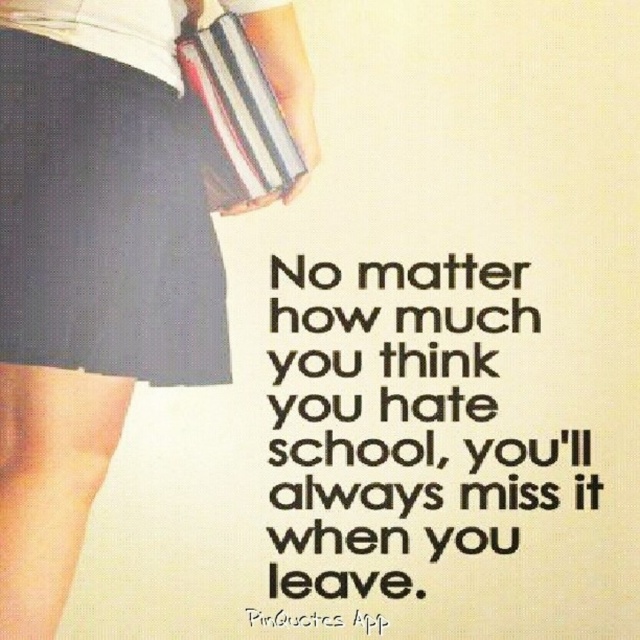
Based on the scene description, what is the color of the fabric at the coordinates point (x=102, y=221)?

The dark blue fabric skirt at lower left is represented by point (x=102, y=221), so the color is dark blue.

Where is the black paper text at center located in the image?

The black paper text at center is located at the point coordinates of (406, 422).

You are a photographer standing at a distance of 4 feet from the subject. You want to capture a closeup shot of the matte black skirt at lower left. Is the current distance sufficient for a clear closeup?

The distance between the matte black skirt at lower left and the viewer is 3.75 feet, which is less than 4 feet. Therefore, the current distance is sufficient for a clear closeup.